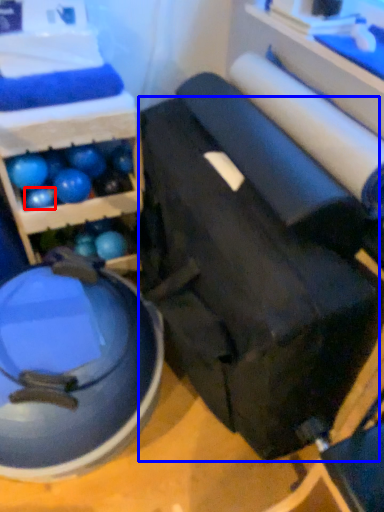
Question: Which object is further to the camera taking this photo, ball (highlighted by a red box) or swivel chair (highlighted by a blue box)?

Choices:
 (A) ball
 (B) swivel chair

Answer: (A)